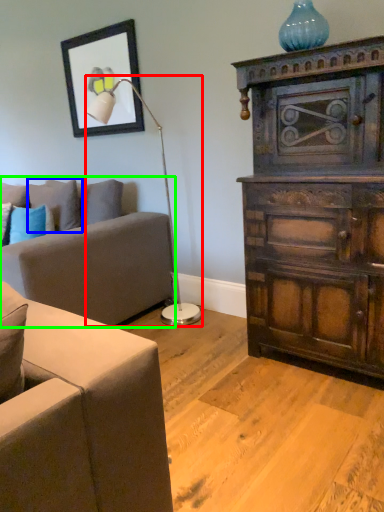
Question: Considering the real-world distances, which object is farthest from table lamp (highlighted by a red box)? pillow (highlighted by a blue box) or studio couch (highlighted by a green box)?

Choices:
 (A) pillow
 (B) studio couch

Answer: (A)